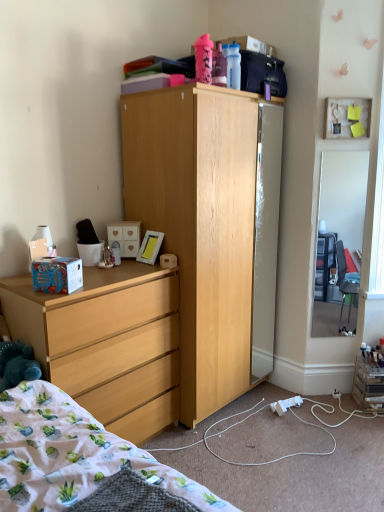
You are a GUI agent. You are given a task and a screenshot of the screen. Output one action in this format:
    pyautogui.click(x=<x>, y=<y>)
    Task: Click on the free space in front of light wood cabinet at center
    The width and height of the screenshot is (384, 512).
    Given the screenshot: What is the action you would take?
    pyautogui.click(x=253, y=453)